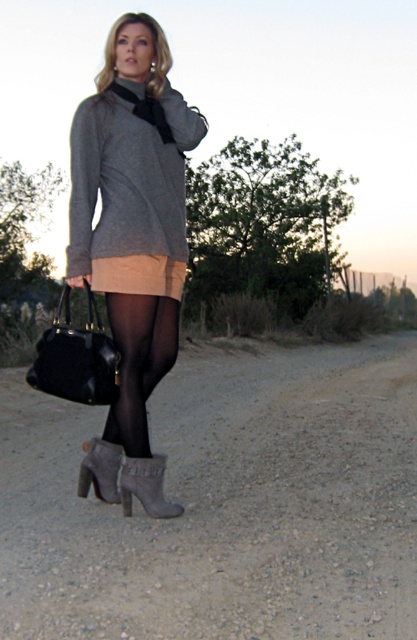
Question: Which is farther from the suede gray boot at lower center?

Choices:
 (A) gray matte sweater at upper center
 (B) black sheer tights at lower center
 (C) matte gray sweater at center

Answer: (A)

Question: Is matte gray sweater at center below black leather handbag at lower left?

Choices:
 (A) yes
 (B) no

Answer: (B)

Question: Is gray gravel road at center positioned at the back of black sheer tights at lower center?

Choices:
 (A) no
 (B) yes

Answer: (A)

Question: Which point appears closest to the camera in this image?

Choices:
 (A) (379, 496)
 (B) (147, 394)
 (C) (108, 342)
 (D) (82, 172)

Answer: (C)

Question: Which object is closer to the camera taking this photo?

Choices:
 (A) matte gray sweater at center
 (B) black leather handbag at lower left

Answer: (B)

Question: Is matte gray sweater at center to the left of suede gray boot at lower center from the viewer's perspective?

Choices:
 (A) no
 (B) yes

Answer: (A)